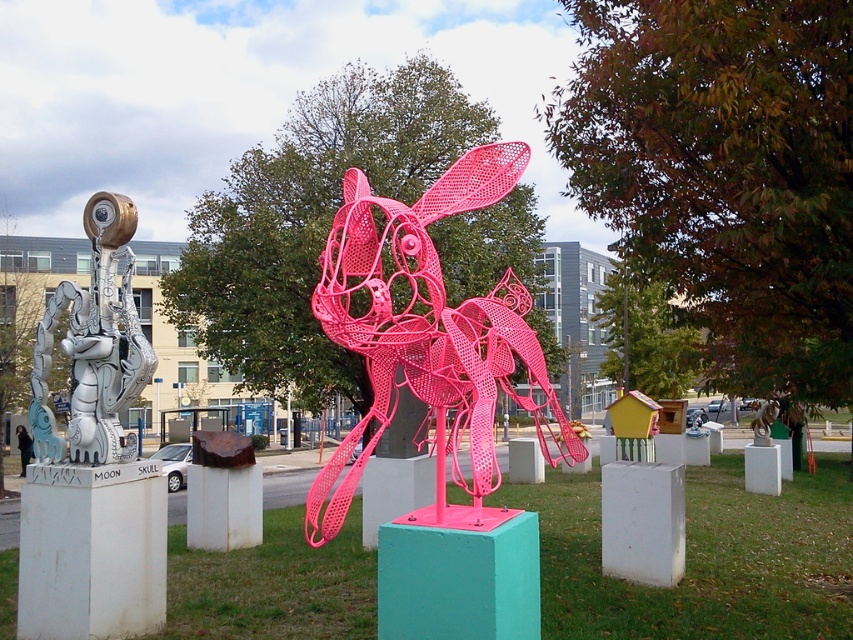
You are an art critic standing in front of the pink wireframe rabbit at center and the pink wireframe dog at center. Which sculpture is positioned lower in the image?

The pink wireframe rabbit at center is located below the pink wireframe dog at center, so the rabbit is positioned lower.

You are an art curator planning to rearrange the sculptures. If you want to move the pink wireframe rabbit at center closer to the brushed metal sphere at left, which direction should you move it?

The pink wireframe rabbit at center is currently positioned on the right side of the brushed metal sphere at left. To move it closer, you should move it to the left.